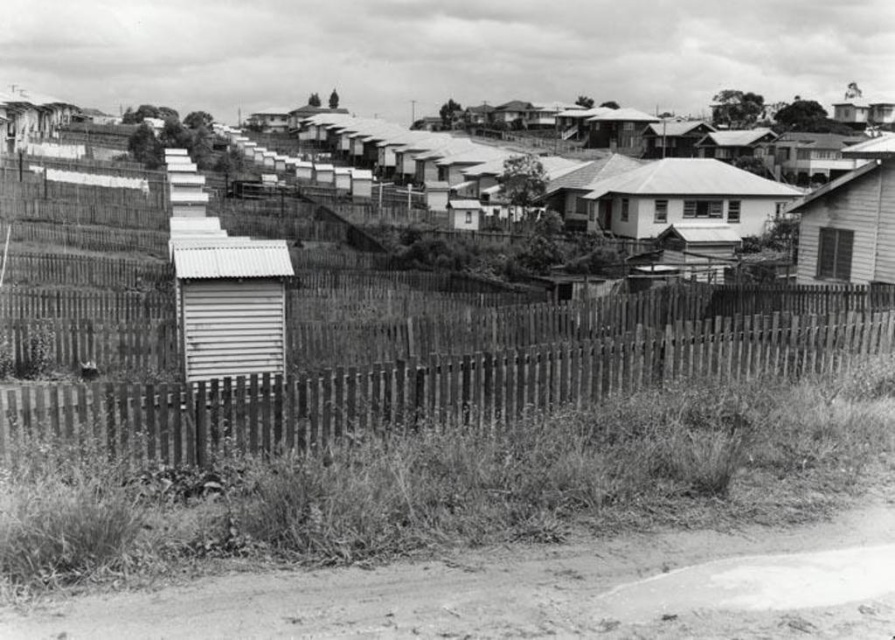
Which is more to the left, dirt track at lower center or wooden shack at right?

dirt track at lower center

Between dirt track at lower center and wooden shack at right, which one has more height?

wooden shack at right

Who is more distant from viewer, [812,540] or [862,266]?

Point [862,266]

Where is `dirt track at lower center`? The width and height of the screenshot is (895, 640). dirt track at lower center is located at coordinates (534, 592).

In the scene shown: Which is below, white corrugated metal hut at center or smooth white house at center?

Positioned lower is white corrugated metal hut at center.

Between white corrugated metal hut at center and smooth white house at center, which one appears on the right side from the viewer's perspective?

Positioned to the right is smooth white house at center.

What do you see at coordinates (229, 305) in the screenshot?
I see `white corrugated metal hut at center` at bounding box center [229, 305].

The width and height of the screenshot is (895, 640). I want to click on white corrugated metal hut at center, so click(229, 305).

Which of these two, wooden picket fence at center or smooth white house at center, stands shorter?

Standing shorter between the two is wooden picket fence at center.

This screenshot has height=640, width=895. What do you see at coordinates (454, 381) in the screenshot?
I see `wooden picket fence at center` at bounding box center [454, 381].

Describe the element at coordinates (454, 381) in the screenshot. I see `wooden picket fence at center` at that location.

You are a GUI agent. You are given a task and a screenshot of the screen. Output one action in this format:
    pyautogui.click(x=<x>, y=<y>)
    Task: Click on the wooden picket fence at center
    The height and width of the screenshot is (640, 895).
    Given the screenshot: What is the action you would take?
    pyautogui.click(x=454, y=381)